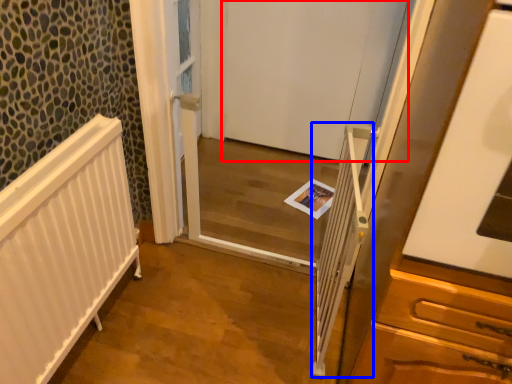
Question: Which object appears closest to the camera in this image, door (highlighted by a red box) or balustrade (highlighted by a blue box)?

Choices:
 (A) door
 (B) balustrade

Answer: (B)